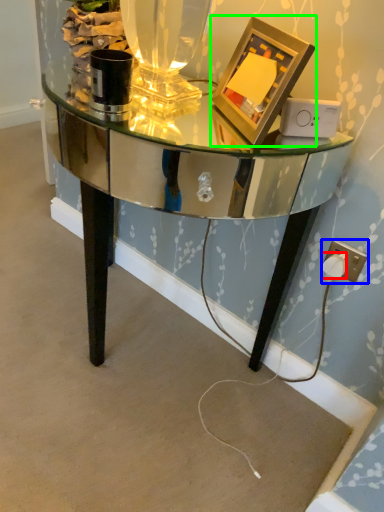
Question: Which is farther away from plug (highlighted by a red box)? electric outlet (highlighted by a blue box) or picture frame (highlighted by a green box)?

Choices:
 (A) electric outlet
 (B) picture frame

Answer: (B)